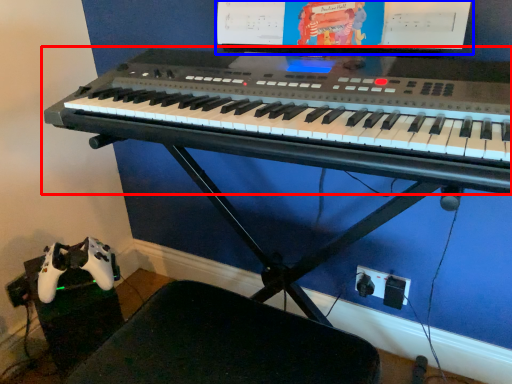
Question: Which point is closer to the camera, musical keyboard (highlighted by a red box) or computer monitor (highlighted by a blue box)?

Choices:
 (A) musical keyboard
 (B) computer monitor

Answer: (A)